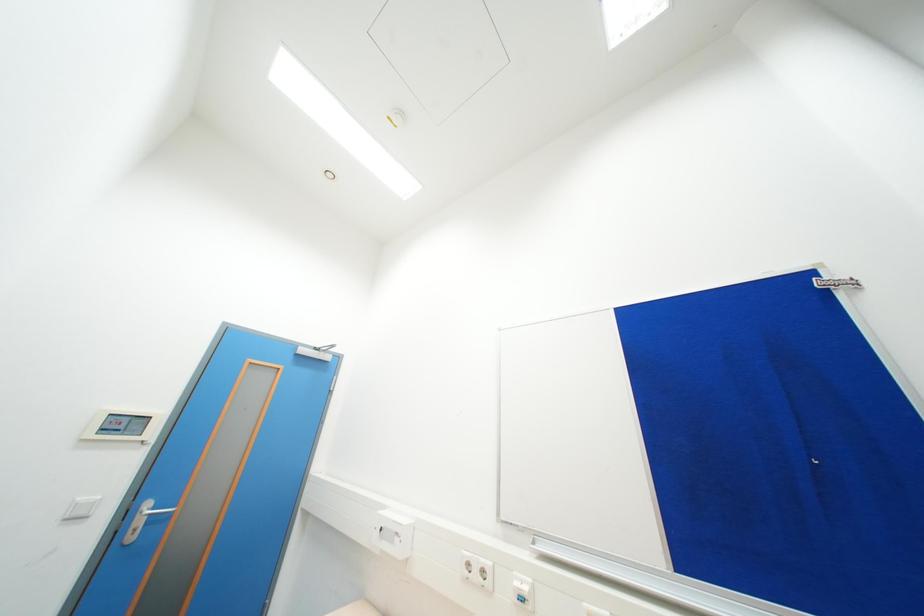
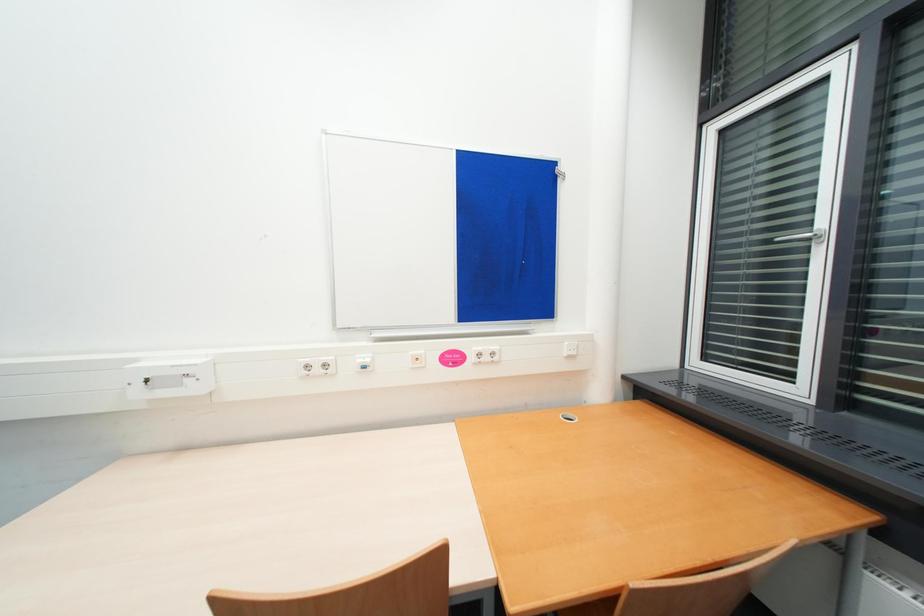
Based on the continuous images, in which direction is the camera rotating?

The camera's rotation is toward right-down.